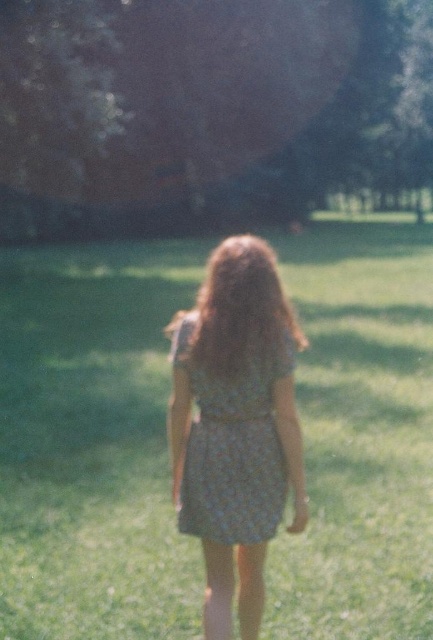
Question: Which of the following is the closest to the observer?

Choices:
 (A) floral dress at center
 (B) brown wavy hair at center
 (C) floral-patterned fabric dress at center
 (D) green textured grass at center

Answer: (C)

Question: Does green textured grass at center appear over brown wavy hair at center?

Choices:
 (A) yes
 (B) no

Answer: (A)

Question: Is green textured grass at center positioned at the back of floral dress at center?

Choices:
 (A) no
 (B) yes

Answer: (B)

Question: Among these points, which one is farthest from the camera?

Choices:
 (A) (28, 554)
 (B) (207, 358)
 (C) (228, 385)
 (D) (290, 381)

Answer: (A)

Question: Considering the real-world distances, which object is closest to the green textured grass at center?

Choices:
 (A) floral dress at center
 (B) brown wavy hair at center

Answer: (B)

Question: Can you confirm if green textured grass at center is positioned to the right of floral-patterned fabric dress at center?

Choices:
 (A) yes
 (B) no

Answer: (B)